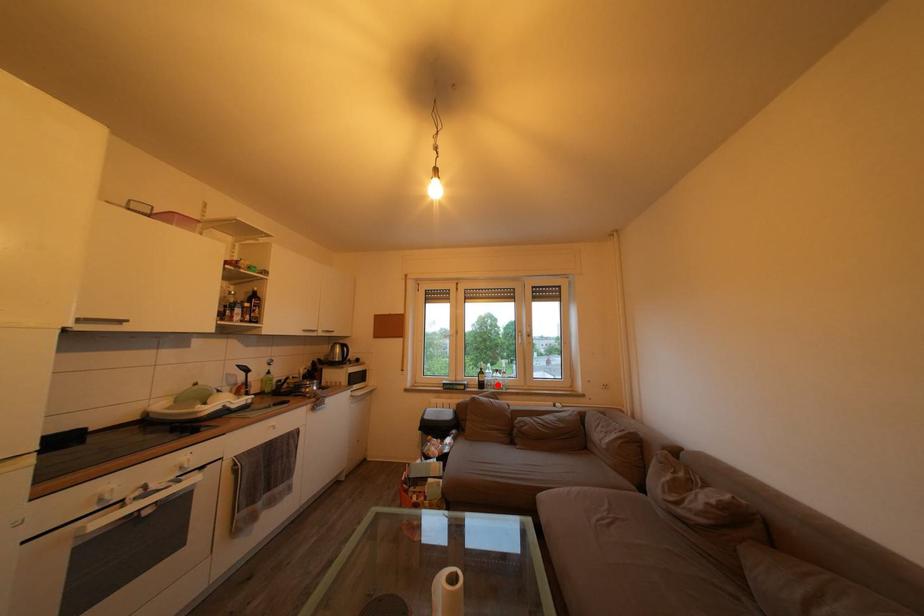
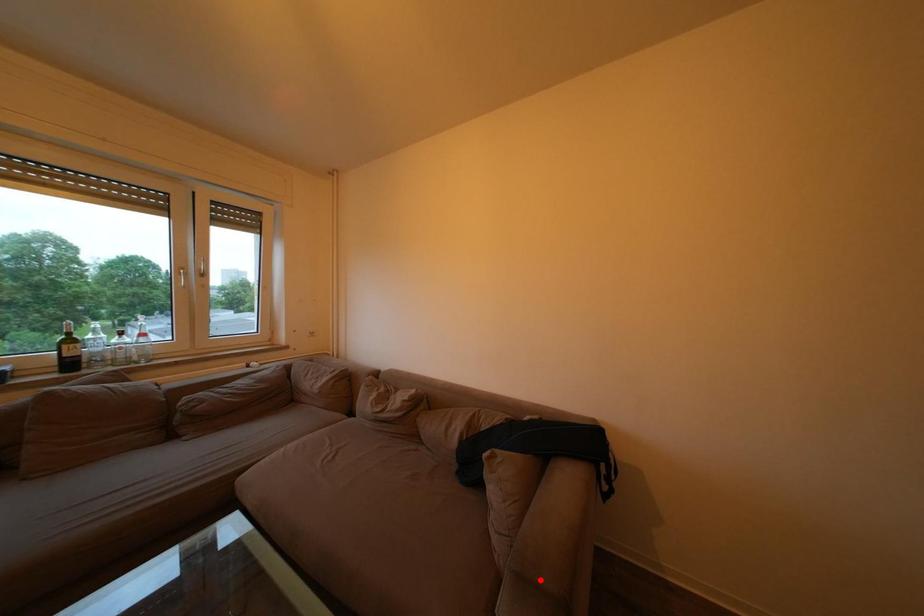
I am providing you with two images of the same scene from different viewpoints. A red point is marked on the first image and another point is marked on the second image. Are the points marked in image1 and image2 representing the same 3D position?

No